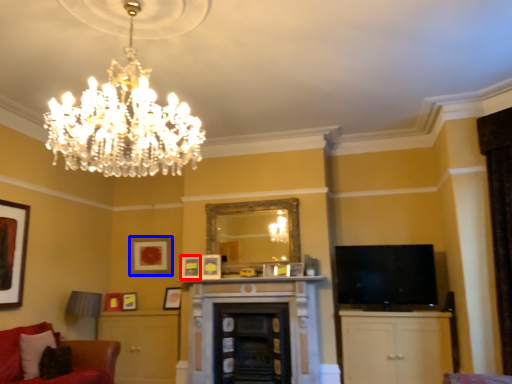
Question: Which object is closer to the camera taking this photo, picture frame (highlighted by a red box) or picture frame (highlighted by a blue box)?

Choices:
 (A) picture frame
 (B) picture frame

Answer: (A)